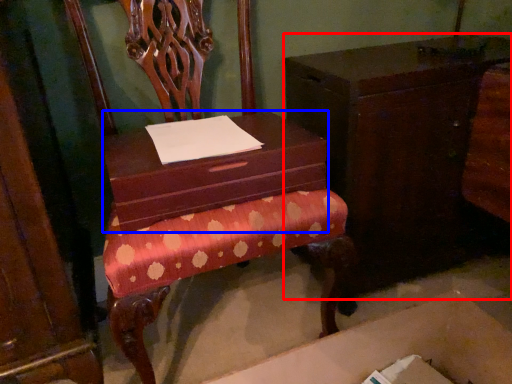
Question: Which object is further to the camera taking this photo, furniture (highlighted by a red box) or shoe box (highlighted by a blue box)?

Choices:
 (A) furniture
 (B) shoe box

Answer: (A)